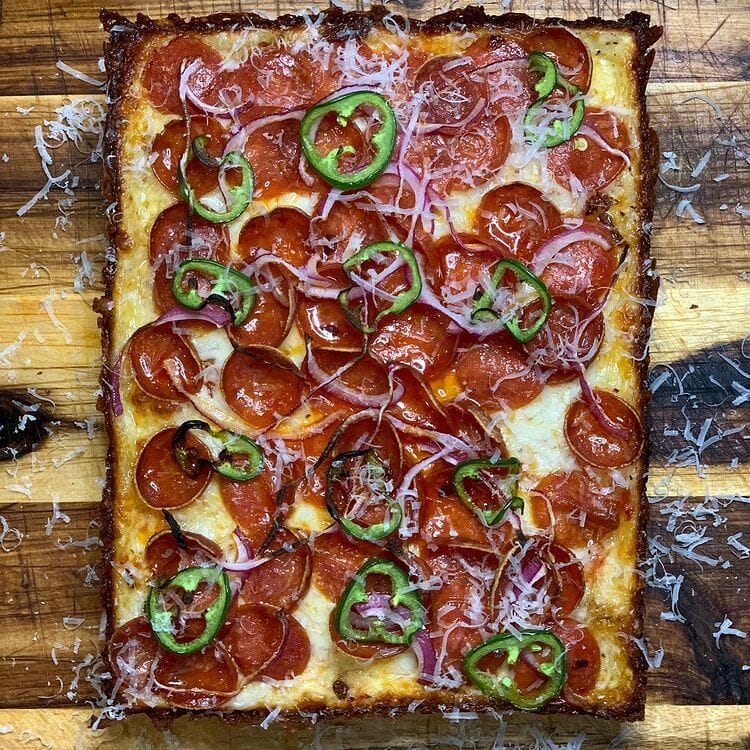
Image resolution: width=750 pixels, height=750 pixels. I want to click on table, so click(60, 628).